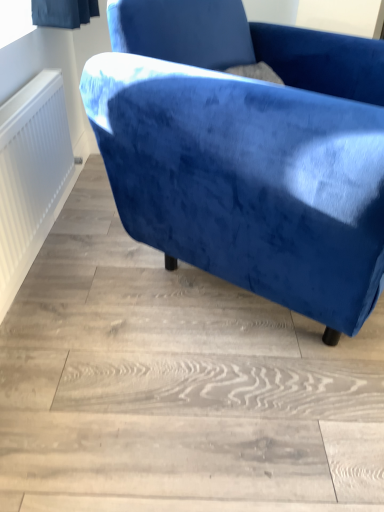
Question: Should I look upward or downward to see velvet blue armchair at upper right?

Choices:
 (A) down
 (B) up

Answer: (B)

Question: Is velvet blue armchair at upper right not inside white textured radiator at left?

Choices:
 (A) no
 (B) yes

Answer: (B)

Question: Is velvet blue armchair at upper right far from white textured radiator at left?

Choices:
 (A) no
 (B) yes

Answer: (A)

Question: Is white textured radiator at left located within velvet blue armchair at upper right?

Choices:
 (A) no
 (B) yes

Answer: (A)

Question: Can you confirm if velvet blue armchair at upper right is wider than white textured radiator at left?

Choices:
 (A) no
 (B) yes

Answer: (B)

Question: From a real-world perspective, is velvet blue armchair at upper right physically below white textured radiator at left?

Choices:
 (A) yes
 (B) no

Answer: (B)

Question: Can you confirm if velvet blue armchair at upper right is taller than white textured radiator at left?

Choices:
 (A) yes
 (B) no

Answer: (A)

Question: Is white textured radiator at left at the right side of velvet blue armchair at upper right?

Choices:
 (A) no
 (B) yes

Answer: (A)

Question: From a real-world perspective, is white textured radiator at left positioned under velvet blue armchair at upper right based on gravity?

Choices:
 (A) yes
 (B) no

Answer: (A)

Question: From the image's perspective, is white textured radiator at left located above velvet blue armchair at upper right?

Choices:
 (A) yes
 (B) no

Answer: (B)

Question: Are white textured radiator at left and velvet blue armchair at upper right far apart?

Choices:
 (A) yes
 (B) no

Answer: (B)

Question: Is white textured radiator at left positioned before velvet blue armchair at upper right?

Choices:
 (A) yes
 (B) no

Answer: (B)

Question: Is white textured radiator at left positioned beyond the bounds of velvet blue armchair at upper right?

Choices:
 (A) yes
 (B) no

Answer: (A)

Question: Is white textured radiator at left inside or outside of velvet blue armchair at upper right?

Choices:
 (A) outside
 (B) inside

Answer: (A)